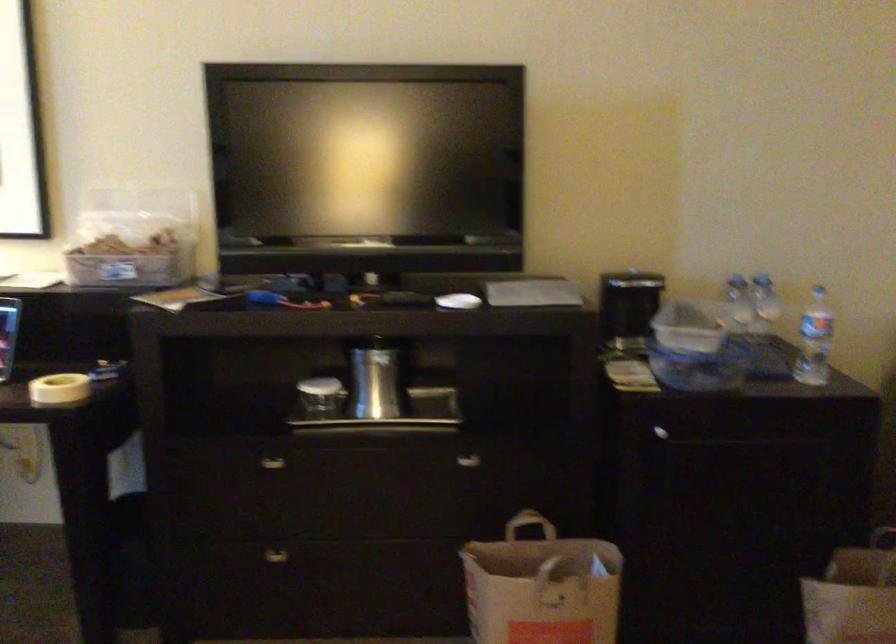
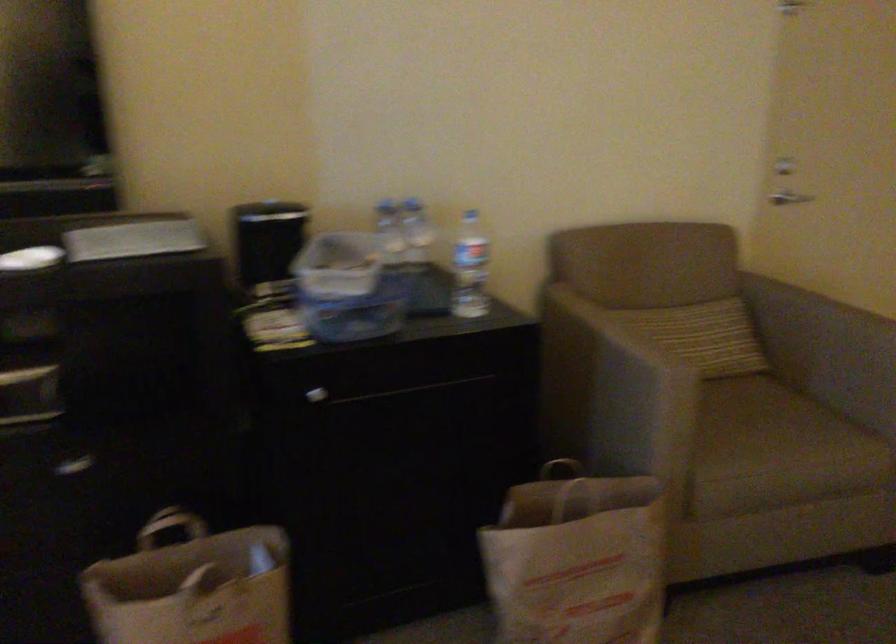
The point at (x=543, y=550) is marked in the first image. Where is the corresponding point in the second image?

(192, 554)